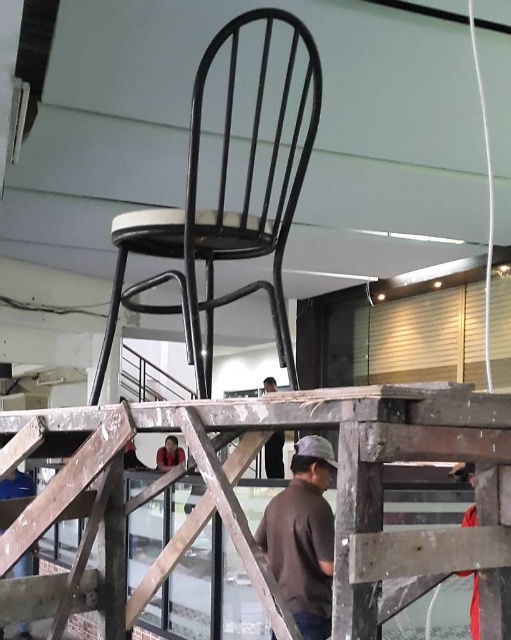
Question: Is black metal chair at center to the right of dark brown leather jacket at lower center from the viewer's perspective?

Choices:
 (A) yes
 (B) no

Answer: (A)

Question: Which point is farther to the camera?

Choices:
 (A) blue fabric at lower left
 (B) wooden at center

Answer: (A)

Question: Which point is closer to the camera?

Choices:
 (A) (296, 598)
 (B) (164, 458)

Answer: (A)

Question: Which point appears farthest from the camera in this image?

Choices:
 (A) (174, 461)
 (B) (277, 436)
 (C) (41, 593)
 (D) (294, 545)

Answer: (A)

Question: Does black leather jacket at center have a lesser width compared to dark brown leather jacket at lower center?

Choices:
 (A) yes
 (B) no

Answer: (A)

Question: Can you confirm if blue fabric at lower left is positioned to the left of black leather jacket at center?

Choices:
 (A) no
 (B) yes

Answer: (B)